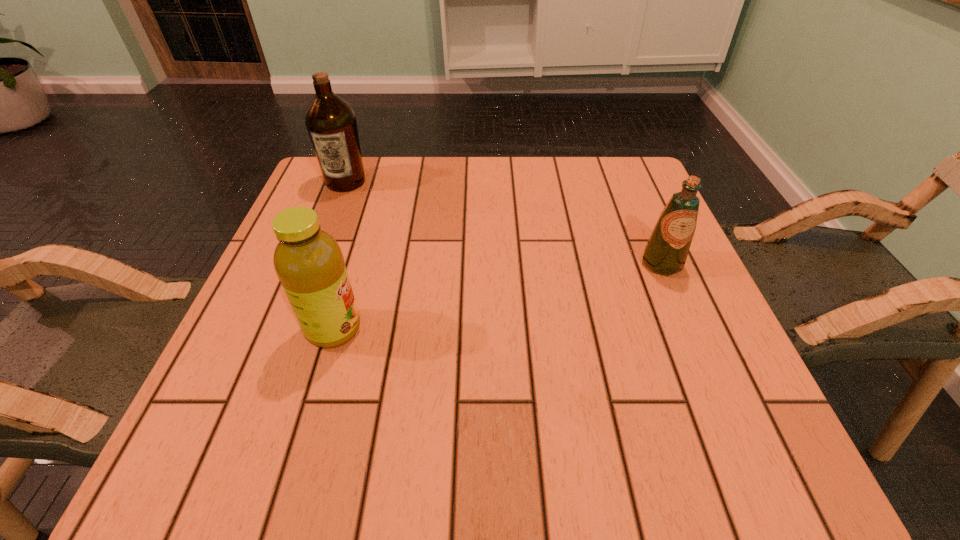
Image resolution: width=960 pixels, height=540 pixels. Find the location of `free spot between the nearest object and the shorter olive oil`. free spot between the nearest object and the shorter olive oil is located at coordinates (497, 296).

Locate an element on the screen. The image size is (960, 540). empty space between the nearer olive oil and the nearest object is located at coordinates (497, 296).

I want to click on free spot between the nearer olive oil and the left olive oil, so click(504, 222).

This screenshot has height=540, width=960. I want to click on free space between the farthest object and the nearer olive oil, so click(x=504, y=222).

This screenshot has width=960, height=540. I want to click on free point between the shortest object and the left olive oil, so click(504, 222).

Identify the location of vacant area that lies between the second nearest object and the taller olive oil. This screenshot has width=960, height=540. (504, 222).

Identify which object is the second closest to the taller olive oil. Please provide its 2D coordinates. Your answer should be formatted as a tuple, i.e. [(x, y)], where the tuple contains the x and y coordinates of a point satisfying the conditions above.

[(666, 251)]

Identify the location of the second closest object relative to the left olive oil. The height and width of the screenshot is (540, 960). (666, 251).

Locate an element on the screen. Image resolution: width=960 pixels, height=540 pixels. free space in the image that satisfies the following two spatial constraints: 1. on the front-facing side of the shorter olive oil; 2. on the front label of the fruit juice is located at coordinates (689, 329).

At what (x,y) coordinates should I click in order to perform the action: click on vacant area that satisfies the following two spatial constraints: 1. on the front-facing side of the shortest object; 2. on the front label of the fruit juice. Please return your answer as a coordinate pair (x, y). This screenshot has height=540, width=960. Looking at the image, I should click on (689, 329).